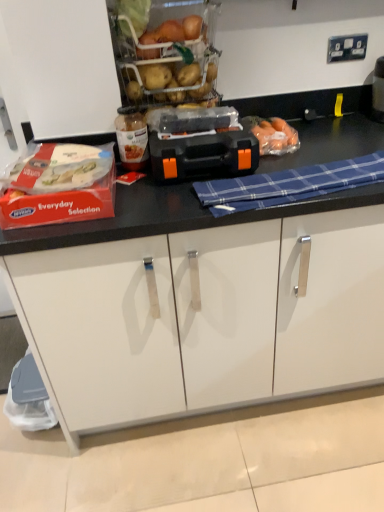
Question: Considering the relative positions of translucent glass jar at center and white matte cabinet at lower center in the image provided, is translucent glass jar at center to the left of white matte cabinet at lower center from the viewer's perspective?

Choices:
 (A) no
 (B) yes

Answer: (B)

Question: From a real-world perspective, is translucent glass jar at center located beneath white matte cabinet at lower center?

Choices:
 (A) no
 (B) yes

Answer: (A)

Question: Is translucent glass jar at center turned away from white matte cabinet at lower center?

Choices:
 (A) yes
 (B) no

Answer: (B)

Question: Is white matte cabinet at lower center a part of translucent glass jar at center?

Choices:
 (A) no
 (B) yes

Answer: (A)

Question: Is translucent glass jar at center completely or partially outside of white matte cabinet at lower center?

Choices:
 (A) yes
 (B) no

Answer: (A)

Question: From a real-world perspective, relative to white matte cabinet at lower center, is black plastic toolbox at center vertically above or below?

Choices:
 (A) above
 (B) below

Answer: (A)

Question: In the image, is black plastic toolbox at center positioned in front of or behind white matte cabinet at lower center?

Choices:
 (A) behind
 (B) front

Answer: (B)

Question: In the image, is black plastic toolbox at center on the left side or the right side of white matte cabinet at lower center?

Choices:
 (A) left
 (B) right

Answer: (B)

Question: In terms of size, does black plastic toolbox at center appear bigger or smaller than white matte cabinet at lower center?

Choices:
 (A) small
 (B) big

Answer: (A)

Question: Is translucent plastic carrots at center, acting as the 2th food starting from the left, in front of or behind white plastic food at left, which is the first food from front to back, in the image?

Choices:
 (A) behind
 (B) front

Answer: (A)

Question: Is point [x=271, y=142] positioned closer to the camera than point [x=56, y=146]?

Choices:
 (A) farther
 (B) closer

Answer: (A)

Question: Is translucent plastic carrots at center, acting as the 2th food starting from the left, to the left or to the right of white plastic food at left, which is the first food from front to back, in the image?

Choices:
 (A) right
 (B) left

Answer: (A)

Question: Based on their sizes in the image, would you say translucent plastic carrots at center, which is the first food in back-to-front order, is bigger or smaller than white plastic food at left, the second food from the right?

Choices:
 (A) small
 (B) big

Answer: (A)

Question: Looking at their shapes, would you say black plastic toolbox at center is wider or thinner than blue plaid cloth at center?

Choices:
 (A) wide
 (B) thin

Answer: (A)

Question: Considering the positions of point (196, 161) and point (322, 185), is point (196, 161) closer or farther from the camera than point (322, 185)?

Choices:
 (A) closer
 (B) farther

Answer: (B)